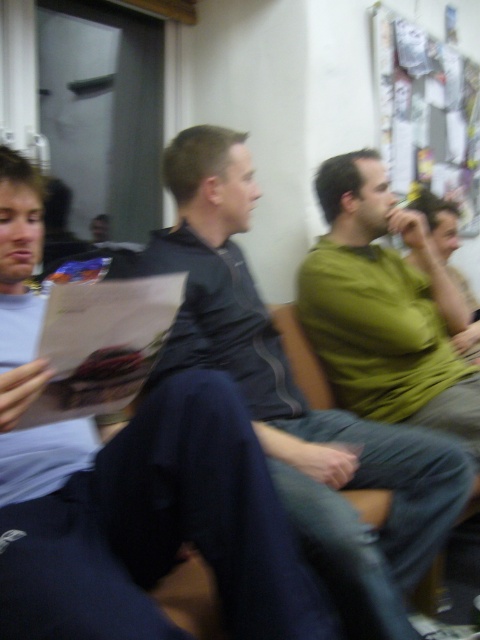
Does dark gray fabric shirt at center have a larger size compared to green matte shirt at center?

Correct, dark gray fabric shirt at center is larger in size than green matte shirt at center.

In the scene shown: Does dark gray fabric shirt at center have a lesser height compared to green matte shirt at center?

No, dark gray fabric shirt at center is not shorter than green matte shirt at center.

Describe the element at coordinates (299, 401) in the screenshot. The image size is (480, 640). I see `dark gray fabric shirt at center` at that location.

The width and height of the screenshot is (480, 640). I want to click on dark gray fabric shirt at center, so click(299, 401).

Between dark gray shirt at center and dark gray fabric shirt at center, which one is positioned higher?

Positioned higher is dark gray fabric shirt at center.

Does dark gray shirt at center have a smaller size compared to dark gray fabric shirt at center?

Yes, dark gray shirt at center is smaller than dark gray fabric shirt at center.

Between point (62, 570) and point (387, 616), which one is positioned behind?

The point (387, 616) is behind.

Where is `dark gray shirt at center`? The width and height of the screenshot is (480, 640). dark gray shirt at center is located at coordinates (131, 490).

Does dark gray shirt at center have a greater width compared to green matte shirt at center?

Correct, the width of dark gray shirt at center exceeds that of green matte shirt at center.

Between point (72, 634) and point (358, 276), which one is positioned in front?

Point (72, 634)

Identify the location of dark gray shirt at center. (131, 490).

I want to click on dark gray shirt at center, so click(x=131, y=490).